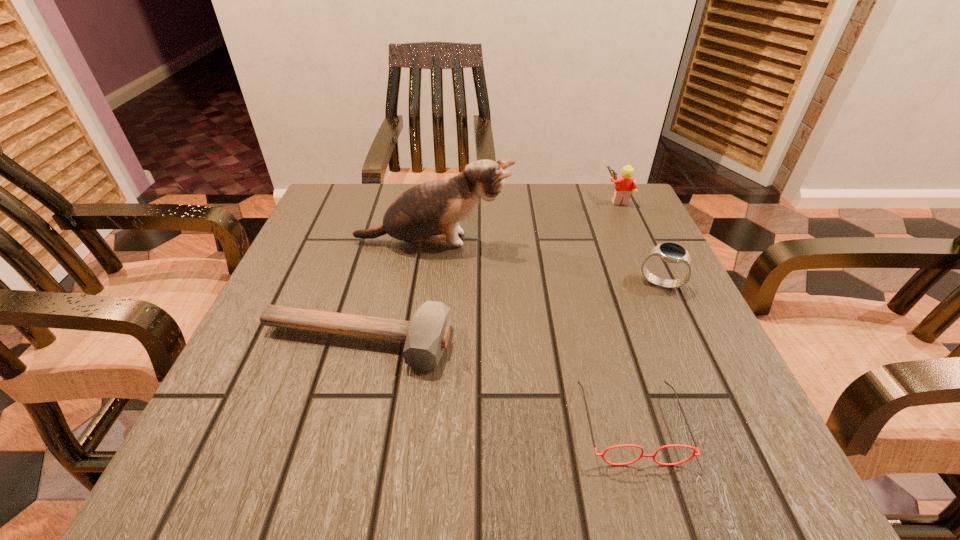
In order to click on free space between the fourth shortest object and the nearest object in this screenshot , I will do `click(624, 310)`.

Find the location of a particular element. The height and width of the screenshot is (540, 960). free spot between the nearest object and the fourth nearest object is located at coordinates (532, 332).

Choose which object is the nearest neighbor to the Lego. Please provide its 2D coordinates. Your answer should be formatted as a tuple, i.e. [(x, y)], where the tuple contains the x and y coordinates of a point satisfying the conditions above.

[(670, 252)]

You are a GUI agent. You are given a task and a screenshot of the screen. Output one action in this format:
    pyautogui.click(x=<x>, y=<y>)
    Task: Click on the object that is the fourth closest to the Lego
    This screenshot has height=540, width=960.
    Given the screenshot: What is the action you would take?
    pyautogui.click(x=425, y=337)

The image size is (960, 540). I want to click on blank area in the image that satisfies the following two spatial constraints: 1. in front of the Lego with the accessory visible; 2. on the front-facing side of the spectacles, so click(x=718, y=422).

Locate an element on the screen. The height and width of the screenshot is (540, 960). blank area in the image that satisfies the following two spatial constraints: 1. on the back side of the watch; 2. on the right side of the mallet is located at coordinates (372, 284).

The height and width of the screenshot is (540, 960). Identify the location of blank space that satisfies the following two spatial constraints: 1. in front of the third shortest object with the accessory visible; 2. on the left side of the farthest object. (656, 284).

At what (x,y) coordinates should I click in order to perform the action: click on vacant region that satisfies the following two spatial constraints: 1. at the face of the third farthest object; 2. on the left side of the fourth nearest object. Please return your answer as a coordinate pair (x, y). This screenshot has height=540, width=960. Looking at the image, I should click on (427, 284).